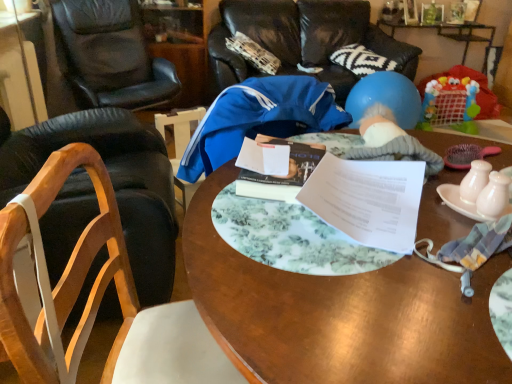
The width and height of the screenshot is (512, 384). What do you see at coordinates (361, 60) in the screenshot? I see `black and white patterned pillow at upper center` at bounding box center [361, 60].

You are a GUI agent. You are given a task and a screenshot of the screen. Output one action in this format:
    pyautogui.click(x=<x>, y=<y>)
    Task: Click on the black and white patterned pillow at upper center
    Image resolution: width=512 pixels, height=384 pixels.
    Given the screenshot: What is the action you would take?
    pyautogui.click(x=361, y=60)

Find the location of a particular element. wooden chair at left, which appears as the first chair when viewed from the front is located at coordinates (100, 297).

Consider the image. In order to face hardcover book at center, should I rotate leftwards or rightwards?

To face it directly, rotate right by 3.879 degrees.

The height and width of the screenshot is (384, 512). What do you see at coordinates (267, 191) in the screenshot?
I see `hardcover book at center` at bounding box center [267, 191].

Measure the distance between point (409, 103) and camera.

The depth of point (409, 103) is 2.91 meters.

What do you see at coordinates (110, 55) in the screenshot?
I see `black leather chair at left, which is the third chair from front to back` at bounding box center [110, 55].

What is the approximate width of white paper at center?

It is 32.46 centimeters.

The width and height of the screenshot is (512, 384). I want to click on pink ceramic plate at right, so click(x=465, y=203).

Consider the image. Based on their positions, is hardcover book at center located to the left or right of blue fabric chair at upper center, arranged as the 1th chair when viewed from the back?

hardcover book at center is to the left of blue fabric chair at upper center, arranged as the 1th chair when viewed from the back.

Is hardcover book at center oriented towards blue fabric chair at upper center, the 4th chair from the front?

Yes, hardcover book at center is aimed at blue fabric chair at upper center, the 4th chair from the front.

What's the angular difference between hardcover book at center and blue fabric chair at upper center, arranged as the 1th chair when viewed from the back,'s facing directions?

The angular difference between hardcover book at center and blue fabric chair at upper center, arranged as the 1th chair when viewed from the back, is 156 degrees.

Is wooden table at center turned away from white paper at center?

That's not correct — wooden table at center is not looking away from white paper at center.

How distant is wooden table at center from white paper at center?

wooden table at center is 5.44 inches from white paper at center.

Is wooden table at center bigger than white paper at center?

Yes, wooden table at center is bigger than white paper at center.

Does wooden table at center have a lesser height compared to white paper at center?

No, wooden table at center is not shorter than white paper at center.

Does point (319, 148) lie behind point (232, 366)?

Yes, it is.

Looking at this image, from a real-world perspective, is hardcover book at center located beneath wooden chair at left, placed as the fourth chair when sorted from back to front?

No, from a real-world perspective, hardcover book at center is not under wooden chair at left, placed as the fourth chair when sorted from back to front.

Is hardcover book at center taller than wooden chair at left, which appears as the first chair when viewed from the front?

No, hardcover book at center is not taller than wooden chair at left, which appears as the first chair when viewed from the front.

Would you say hardcover book at center is a long distance from wooden chair at left, placed as the fourth chair when sorted from back to front?

No, hardcover book at center is in close proximity to wooden chair at left, placed as the fourth chair when sorted from back to front.

Is hardcover book at center at the back of wooden table at center?

wooden table at center does not have its back to hardcover book at center.

Is point (373, 348) positioned before point (271, 193)?

That is True.

Does wooden table at center have a lesser width compared to hardcover book at center?

No, wooden table at center is not thinner than hardcover book at center.

From the picture: Does wooden table at center appear on the left side of hardcover book at center?

No, wooden table at center is not to the left of hardcover book at center.

Does white paper at center contain blue rubber balloon at center?

No.

From the image's perspective, between white paper at center and blue rubber balloon at center, who is located below?

white paper at center appears lower in the image.

Considering the relative positions of white paper at center and blue rubber balloon at center in the image provided, is white paper at center to the left of blue rubber balloon at center from the viewer's perspective?

Correct, you'll find white paper at center to the left of blue rubber balloon at center.

Which point is more forward, (x=450, y=196) or (x=245, y=186)?

The point (x=450, y=196) is more forward.

From the image's perspective, is pink ceramic plate at right above or below hardcover book at center?

Clearly, from the image's perspective, pink ceramic plate at right is below hardcover book at center.

Is pink ceramic plate at right spatially inside hardcover book at center, or outside of it?

pink ceramic plate at right lies outside hardcover book at center.

Does point (398, 118) come farther from viewer compared to point (475, 218)?

Yes, point (398, 118) is behind point (475, 218).

Can you confirm if blue rubber balloon at center is taller than pink ceramic plate at right?

Indeed, blue rubber balloon at center has a greater height compared to pink ceramic plate at right.

From a real-world perspective, relative to pink ceramic plate at right, is blue rubber balloon at center vertically above or below?

blue rubber balloon at center is below pink ceramic plate at right.

Considering their positions, is blue rubber balloon at center located in front of or behind pink ceramic plate at right?

Visually, blue rubber balloon at center is located behind pink ceramic plate at right.

You are a GUI agent. You are given a task and a screenshot of the screen. Output one action in this format:
    pyautogui.click(x=<x>, y=<y>)
    Task: Click on the book located on the left of blue fabric chair at upper center, arranged as the 1th chair when viewed from the back
    Image resolution: width=512 pixels, height=384 pixels.
    Given the screenshot: What is the action you would take?
    pyautogui.click(x=267, y=191)

Identify the location of desk that appears on the right of white paper at center. (340, 314).

Based on their spatial positions, is pink ceramic plate at right or white paper at center further from blue rubber balloon at center?

Based on the image, pink ceramic plate at right appears to be further to blue rubber balloon at center.

Looking at the image, which one is located closer to white paper at center, black leather chair at left, acting as the second chair starting from the back, or blue rubber balloon at center?

blue rubber balloon at center is positioned closer to the anchor white paper at center.

Which object lies nearer to the anchor point green glass bottle at upper right, blue rubber ball at upper right or pink ceramic plate at right?

The object closer to green glass bottle at upper right is blue rubber ball at upper right.

Estimate the real-world distances between objects in this image. Which object is closer to black and white patterned pillow at upper center, green glass bottle at upper right or hardcover book at center?

green glass bottle at upper right.

Estimate the real-world distances between objects in this image. Which object is further from white paper at center, hardcover book at center or blue rubber ball at upper right?

Based on the image, blue rubber ball at upper right appears to be further to white paper at center.

Estimate the real-world distances between objects in this image. Which object is further from wooden table at center, pink ceramic plate at right or black and white patterned pillow at upper center?

black and white patterned pillow at upper center lies further to wooden table at center than the other object.

Based on their spatial positions, is blue rubber ball at upper right or wooden chair at left, the second chair in the front-to-back sequence, further from blue fabric chair at upper center, arranged as the 1th chair when viewed from the back?

wooden chair at left, the second chair in the front-to-back sequence.

Which object lies further to the anchor point wooden chair at left, the second chair in the front-to-back sequence, black and white patterned pillow at upper center or white paper at center?

Among the two, black and white patterned pillow at upper center is located further to wooden chair at left, the second chair in the front-to-back sequence.

Locate an element on the screen. The image size is (512, 384). chair located between hardcover book at center and black leather chair at left, acting as the second chair starting from the back, in the depth direction is located at coordinates (111, 181).

This screenshot has height=384, width=512. Find the location of `balloon between wooden chair at left, placed as the fourth chair when sorted from back to front, and black and white patterned pillow at upper center from front to back`. balloon between wooden chair at left, placed as the fourth chair when sorted from back to front, and black and white patterned pillow at upper center from front to back is located at coordinates (386, 97).

The height and width of the screenshot is (384, 512). I want to click on balloon between white paper at center and black and white patterned pillow at upper center in the front-back direction, so click(x=386, y=97).

At what (x,y) coordinates should I click in order to perform the action: click on book located between pink ceramic plate at right and blue rubber balloon at center in the depth direction. Please return your answer as a coordinate pair (x, y). Looking at the image, I should click on (267, 191).